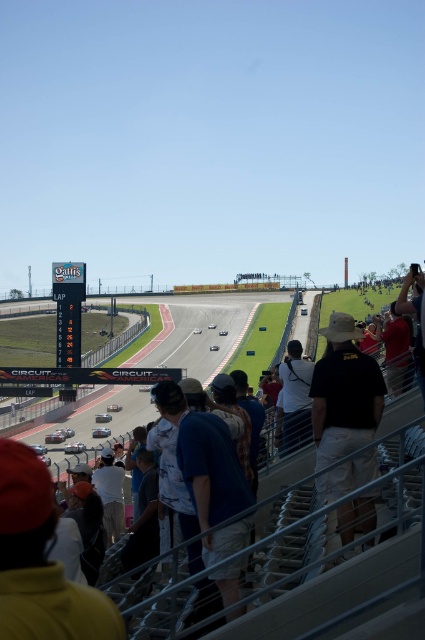
You are a drone operator trying to capture aerial footage of the race. You need to fly your drone from the point closer to the camera to the point further away. Which path should you take between the two points, point (68, 605) and point (385, 342)?

You should fly your drone from point (68, 605) to point (385, 342) because point (68, 605) is closer to the camera and point (385, 342) is further away.

You are a photographer at the Circuit of the Americas venue. You need to capture a photo that includes both the red shirt at right and the white cotton shirt at lower left. Based on their positions, which shirt should you focus on first to ensure both are in the frame?

The red shirt at right is positioned over the white cotton shirt at lower left, so you should focus on the white cotton shirt at lower left first to ensure both are in the frame.

You are a photographer standing at the Circuit of the Americas venue. You notice two spectators wearing dark blue shirt at lower center and red shirt at right. Which shirt appears narrower in the photo?

The dark blue shirt at lower center appears narrower compared to the red shirt at right.